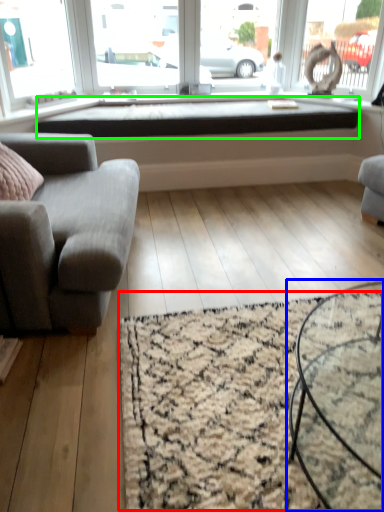
Question: Which object is positioned closest to mat (highlighted by a red box)? Select from coffee table (highlighted by a blue box) and window sill (highlighted by a green box).

Choices:
 (A) coffee table
 (B) window sill

Answer: (A)